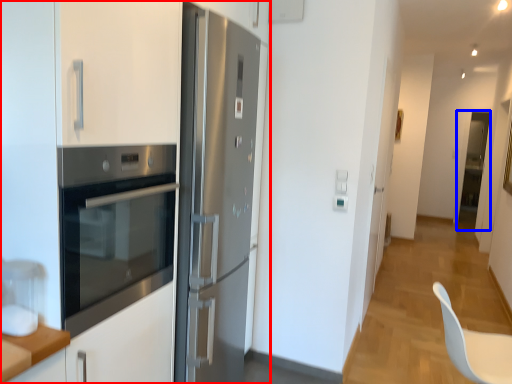
Question: Which object appears closest to the camera in this image, cabinetry (highlighted by a red box) or glass door (highlighted by a blue box)?

Choices:
 (A) cabinetry
 (B) glass door

Answer: (A)